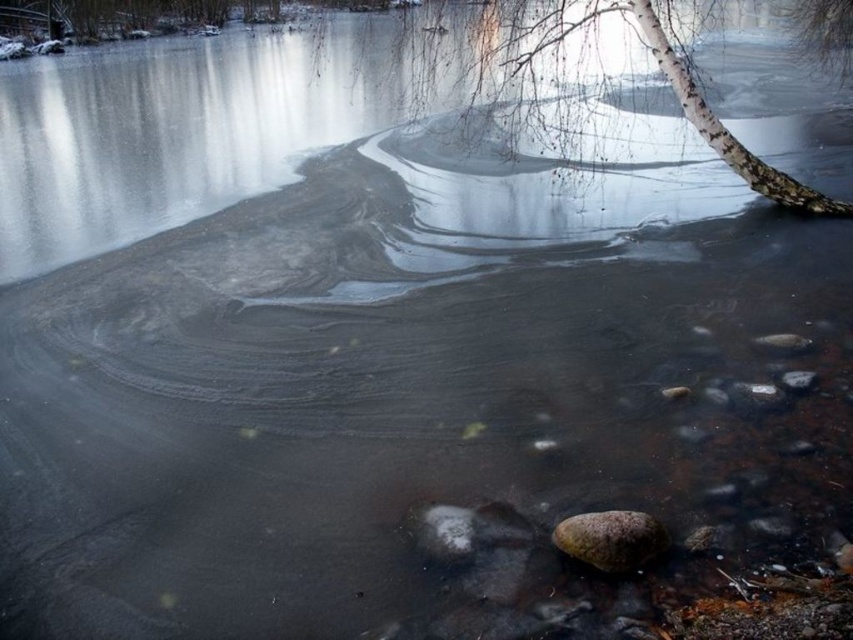
Question: Does white bark tree at upper right have a greater width compared to rusty metallic rock at lower right?

Choices:
 (A) yes
 (B) no

Answer: (A)

Question: Does white bark tree at upper right appear on the left side of rusty metallic rock at lower right?

Choices:
 (A) yes
 (B) no

Answer: (B)

Question: Is white bark tree at upper right bigger than rusty metallic rock at lower right?

Choices:
 (A) yes
 (B) no

Answer: (A)

Question: Which object appears closest to the camera in this image?

Choices:
 (A) white bark tree at upper right
 (B) rusty metallic rock at lower right

Answer: (B)

Question: Among these points, which one is nearest to the camera?

Choices:
 (A) (753, 189)
 (B) (599, 561)

Answer: (B)